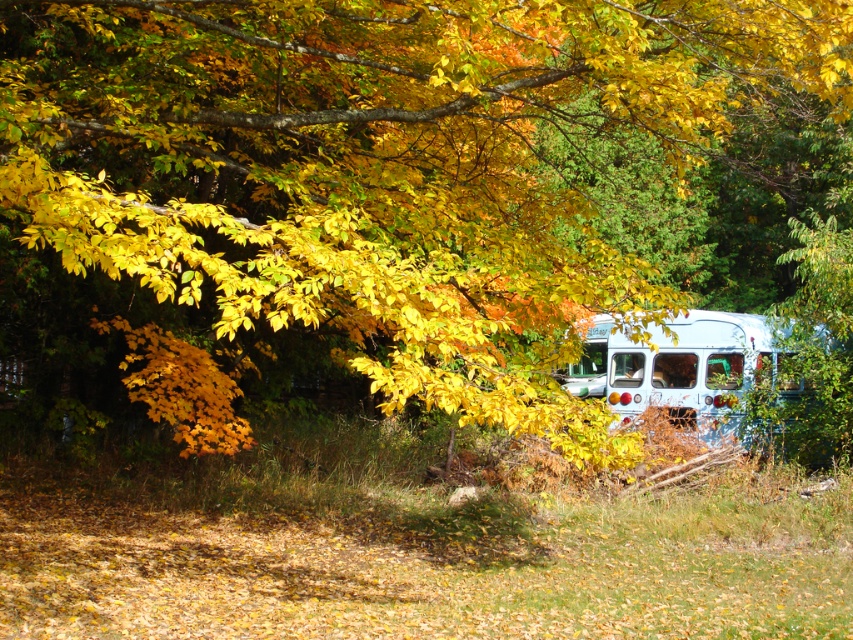
You are a photographer wanting to capture the white matte school bus at right with the yellow matte leaves at upper center in the background. From which side of the bus should you position yourself to ensure the leaves are visible behind the bus?

You should position yourself on the left side of the white matte school bus at right because the yellow matte leaves at upper center are located to the left of the bus, making them visible in the background when viewed from that angle.